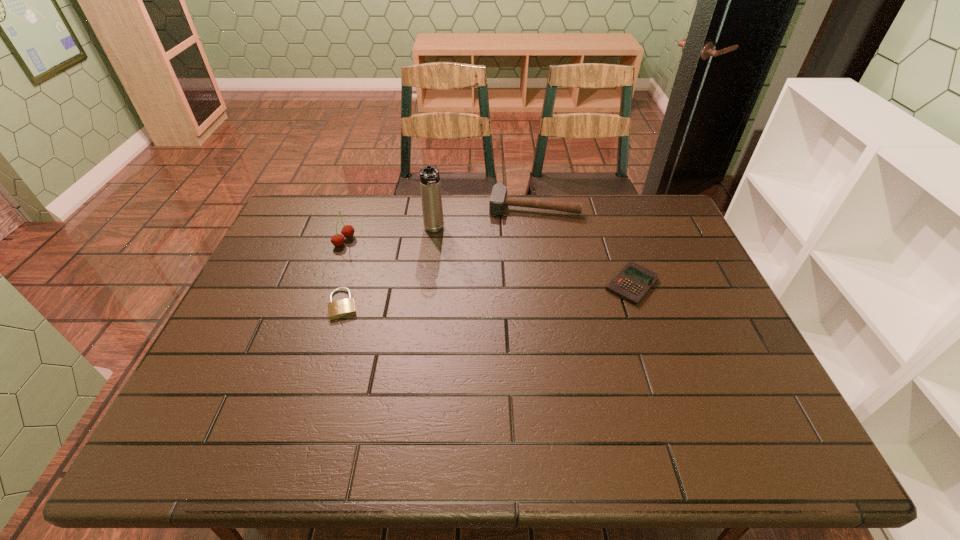
The height and width of the screenshot is (540, 960). Identify the location of vacant space situated on the surface of the second tallest object. (428, 275).

In order to click on vacant space located on the surface of the second tallest object in this screenshot , I will do `click(385, 259)`.

The width and height of the screenshot is (960, 540). Identify the location of vacant space located on the surface of the second tallest object. [454, 286].

At what (x,y) coordinates should I click in order to perform the action: click on blank space located 0.300m on the handle side of the tallest object. Please return your answer as a coordinate pair (x, y). Image resolution: width=960 pixels, height=540 pixels. Looking at the image, I should click on (451, 307).

Find the location of `vacant area situated 0.290m on the handle side of the tallest object`. vacant area situated 0.290m on the handle side of the tallest object is located at coordinates (450, 304).

Locate an element on the screen. The height and width of the screenshot is (540, 960). free location located 0.080m on the handle side of the tallest object is located at coordinates (439, 255).

The width and height of the screenshot is (960, 540). What are the coordinates of `blank space located on the striking surface of the second object from right to left` in the screenshot? It's located at (523, 248).

You are a GUI agent. You are given a task and a screenshot of the screen. Output one action in this format:
    pyautogui.click(x=<x>, y=<y>)
    Task: Click on the free space located on the striking surface of the second object from right to left
    
    Given the screenshot: What is the action you would take?
    pyautogui.click(x=520, y=267)

Identify the location of free space located 0.320m on the striking surface of the second object from right to left. (518, 283).

Image resolution: width=960 pixels, height=540 pixels. Identify the location of cherry located in the far edge section of the desktop. tap(347, 231).